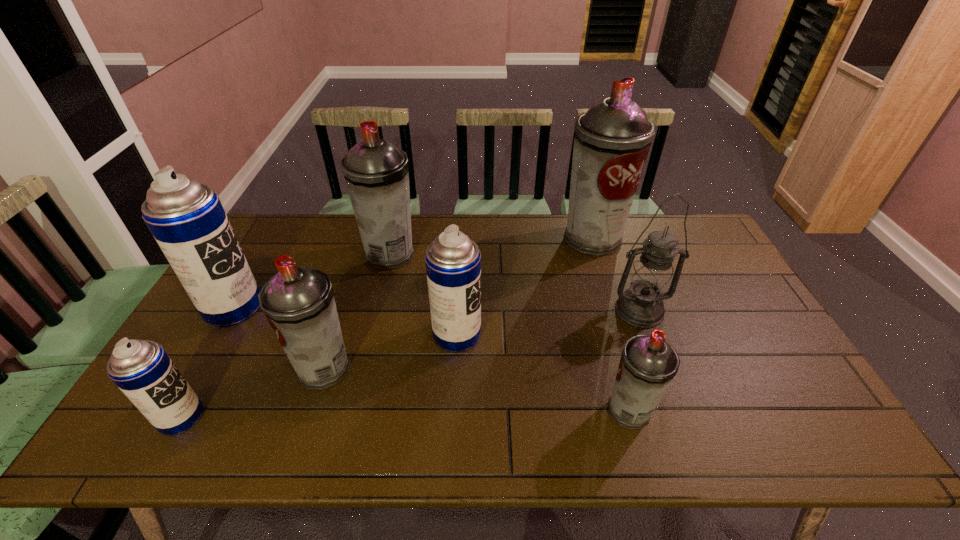
You are a GUI agent. You are given a task and a screenshot of the screen. Output one action in this format:
    pyautogui.click(x=<x>, y=<y>)
    Task: Click on the tallest object
    
    Given the screenshot: What is the action you would take?
    pyautogui.click(x=612, y=139)

Find the location of a particular element. the tallest aerosol can is located at coordinates (612, 139).

Locate an element on the screen. Image resolution: width=960 pixels, height=540 pixels. the biggest blue aerosol can is located at coordinates (186, 218).

Find the location of a particular element. the third smallest gray aerosol can is located at coordinates (376, 173).

This screenshot has height=540, width=960. What are the coordinates of `oil lamp` in the screenshot? It's located at (651, 280).

This screenshot has height=540, width=960. Find the location of `the second smallest gray aerosol can`. the second smallest gray aerosol can is located at coordinates (298, 302).

Find the location of a particular element. The width and height of the screenshot is (960, 540). the rightmost blue aerosol can is located at coordinates (453, 261).

In order to click on the fourth object from right to left in this screenshot , I will do `click(453, 261)`.

Locate an element on the screen. This screenshot has width=960, height=540. the nearest blue aerosol can is located at coordinates (142, 370).

Image resolution: width=960 pixels, height=540 pixels. I want to click on the smallest gray aerosol can, so click(x=648, y=364).